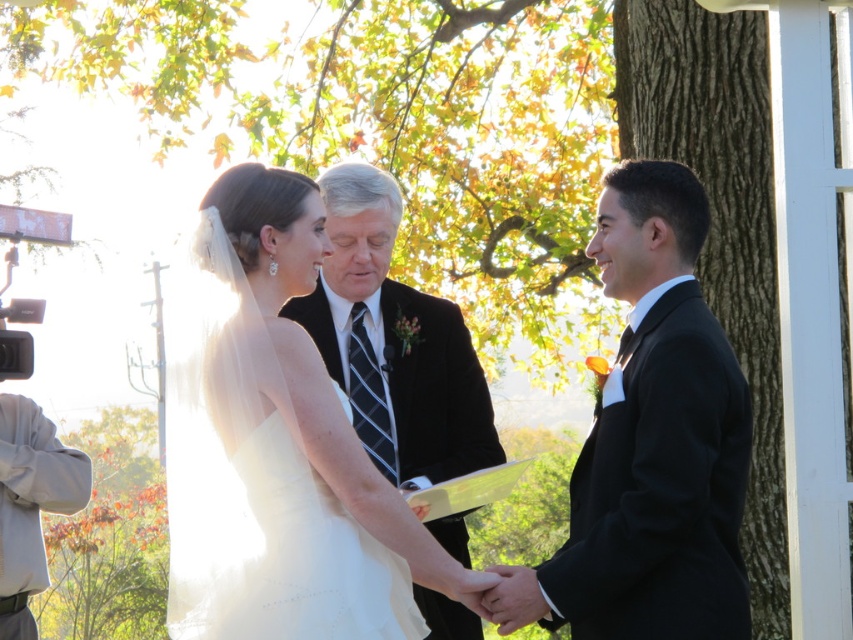
Consider the image. Can you confirm if white satin dress at center is positioned to the left of black satin suit at right?

Indeed, white satin dress at center is positioned on the left side of black satin suit at right.

Can you confirm if white satin dress at center is smaller than black satin suit at right?

Actually, white satin dress at center might be larger than black satin suit at right.

Describe the element at coordinates (277, 448) in the screenshot. I see `white satin dress at center` at that location.

At what (x,y) coordinates should I click in order to perform the action: click on white satin dress at center. Please return your answer as a coordinate pair (x, y). Looking at the image, I should click on (277, 448).